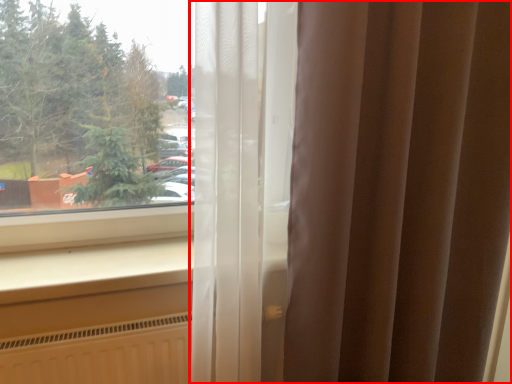
Question: Where is curtain (annotated by the red box) located in relation to window sill in the image?

Choices:
 (A) right
 (B) left

Answer: (A)